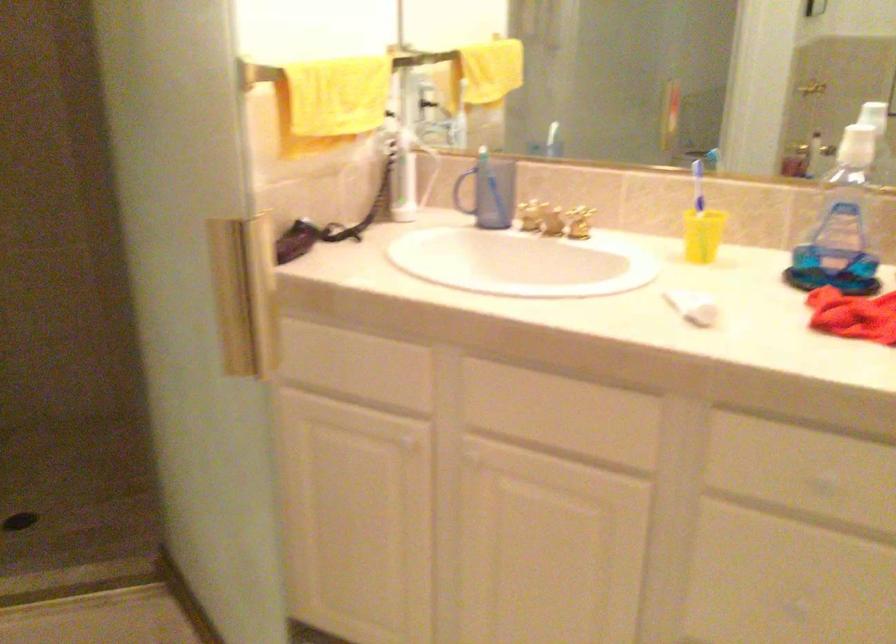
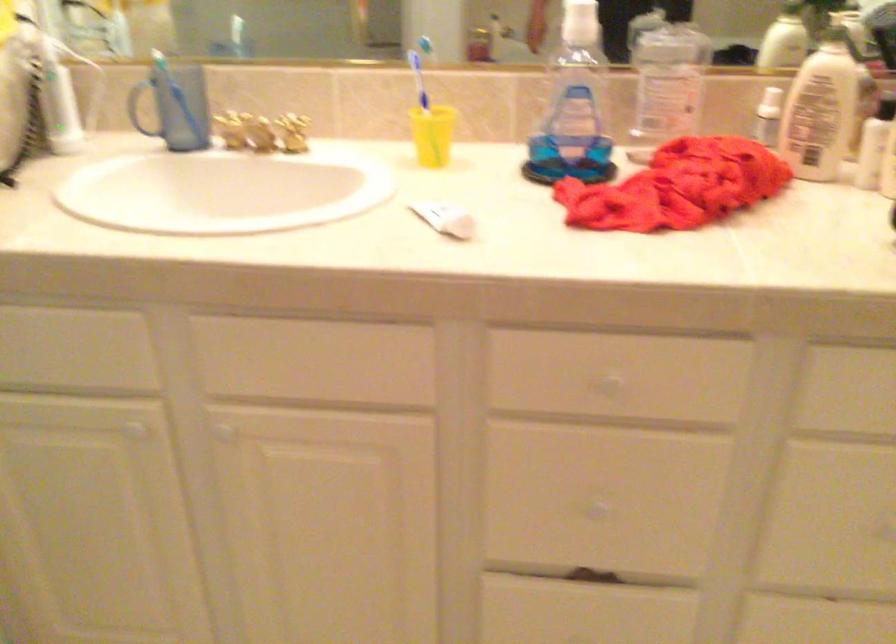
Question: What movement of the cameraman would produce the second image?

Choices:
 (A) Left
 (B) Right
 (C) Forward
 (D) Backward

Answer: (C)